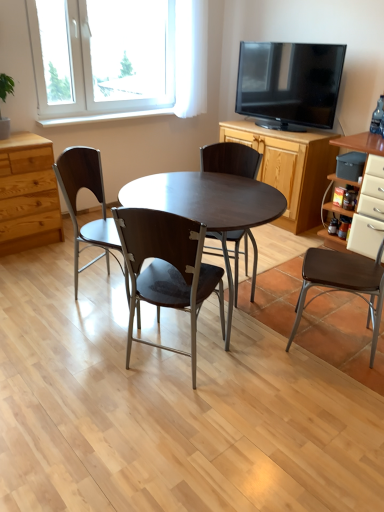
Where is `vacant area that lies between brown leather chair at right, the fourth chair from the left, and matte dark wood table at center`? vacant area that lies between brown leather chair at right, the fourth chair from the left, and matte dark wood table at center is located at coordinates (291, 351).